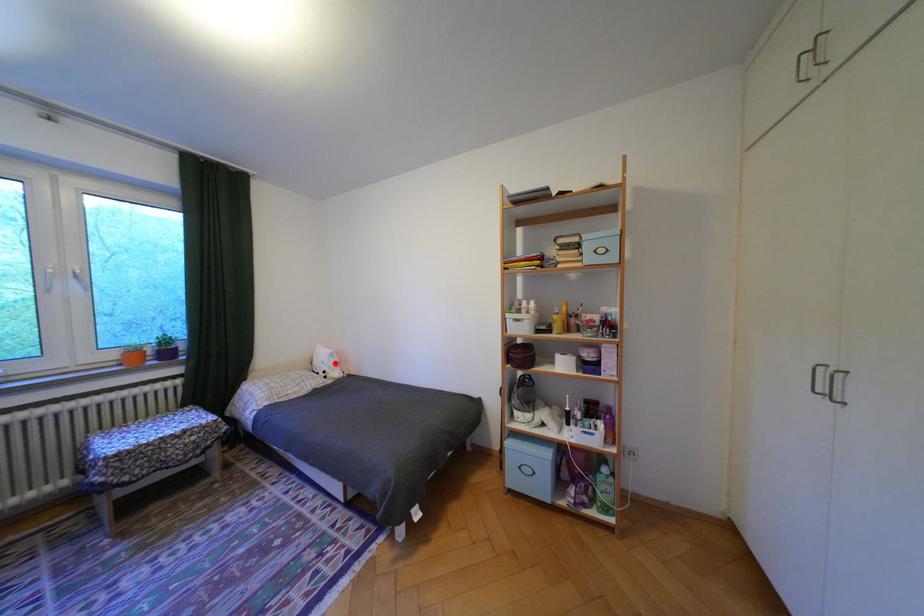
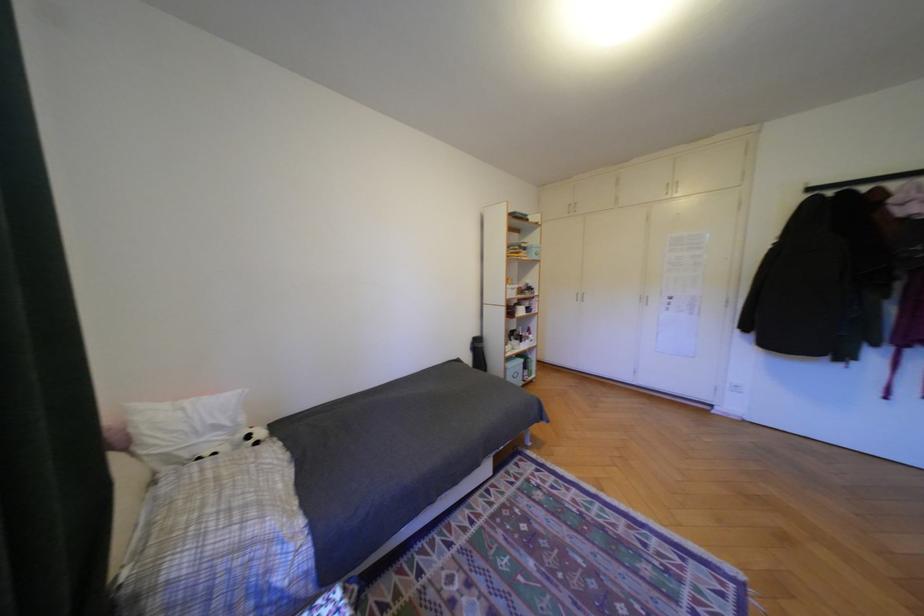
Locate, in the second image, the point that corresponds to the highlighted location in the first image.

(228, 427)